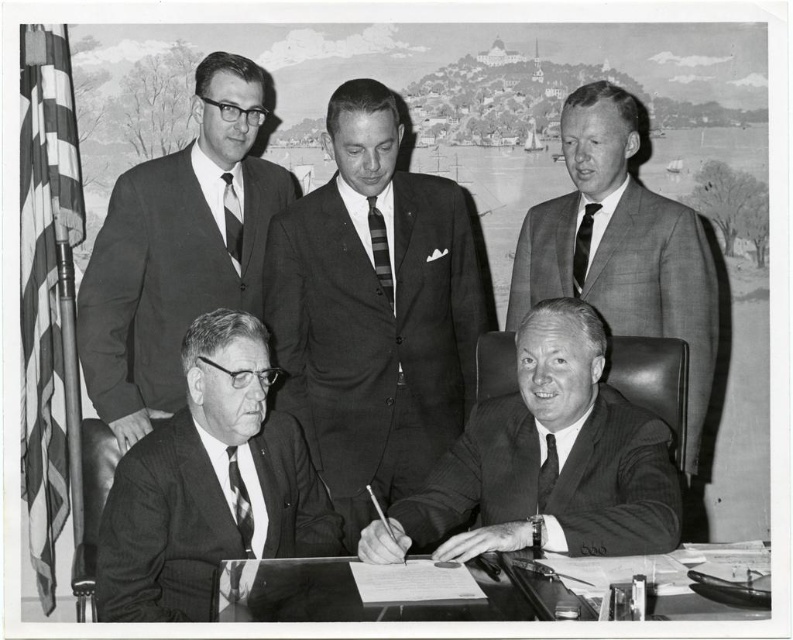
You are a tailor observing a formal meeting scene. You notice two striped ties worn by the men seated at the desk. The first is labeled as the striped fabric tie at lower left and the other as the striped silk tie at upper left. Which of these two ties has a narrower width?

The striped fabric tie at lower left has a lesser width compared to the striped silk tie at upper left.

You are a photographer analyzing this black and white image. You need to determine if the transparent glass table at lower center and the matte black tie at lower right can both fit on a 1.2 meter wide shelf. Based on their sizes, what is your conclusion?

The transparent glass table at lower center is bigger than the matte black tie at lower right. Since the shelf is 1.2 meters wide, both items can fit together as long as their combined size does not exceed the shelf width. However, without exact measurements, we cannot confirm definitively.